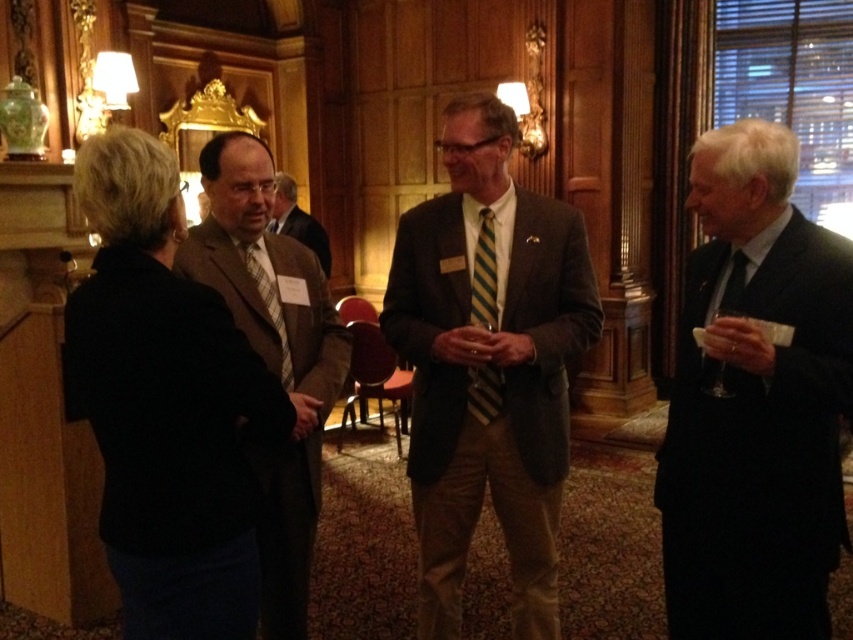
Between matte brown suit at center and plaid fabric tie at center, which one is positioned higher?

matte brown suit at center

Is matte brown suit at center further to the viewer compared to plaid fabric tie at center?

Yes, matte brown suit at center is behind plaid fabric tie at center.

Between point (276, 186) and point (286, 368), which one is positioned behind?

The point (276, 186) is behind.

Find the location of `matte brown suit at center`. matte brown suit at center is located at coordinates (299, 221).

Is dark brown suit at center thinner than striped fabric tie at center?

In fact, dark brown suit at center might be wider than striped fabric tie at center.

The height and width of the screenshot is (640, 853). What do you see at coordinates (488, 364) in the screenshot?
I see `dark brown suit at center` at bounding box center [488, 364].

Is point (448, 556) positioned after point (483, 236)?

Yes, it is behind point (483, 236).

Identify the location of dark brown suit at center. The image size is (853, 640). (488, 364).

Does point (448, 250) lie behind point (247, 260)?

Yes, it is.

Does dark brown suit at center have a larger size compared to plaid fabric tie at center?

Indeed, dark brown suit at center has a larger size compared to plaid fabric tie at center.

Who is more forward, (492, 188) or (283, 340)?

Positioned in front is point (283, 340).

Locate an element on the screen. dark brown suit at center is located at coordinates (488, 364).